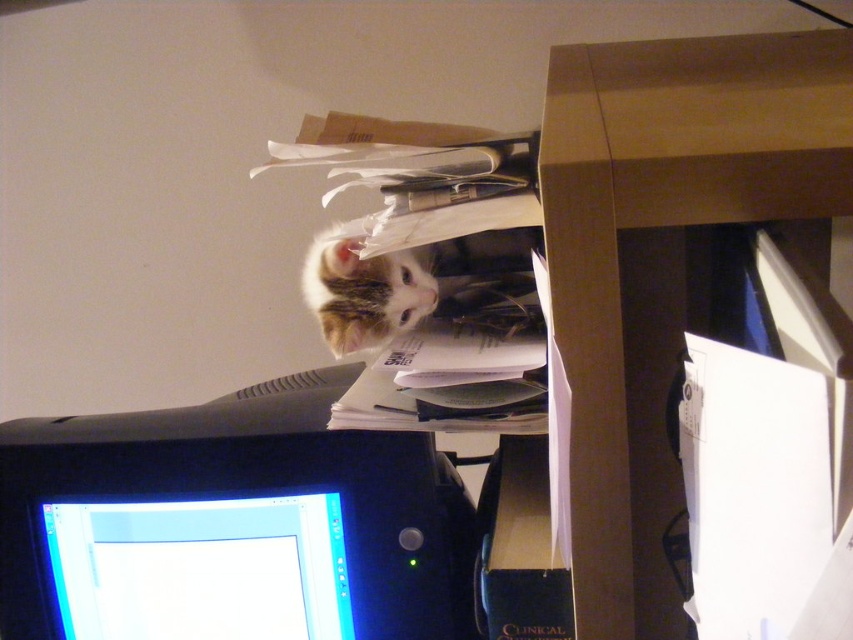
You are a delivery person who needs to place a small package on the desk without disturbing the cat. The package is 10 centimeters wide. The desk has limited space. Considering the black plastic monitor at lower left, can you fit the package on the desk near the monitor?

The black plastic monitor at lower left is 64.68 centimeters away from the camera. Since the package is only 10 centimeters wide, there should be enough space on the desk near the monitor to place it without disturbing the cat.

You are trying to locate the striped fur cat at upper center on a cluttered desk. From the perspective of the cat, which direction would the black plastic monitor at lower left be located?

The black plastic monitor at lower left is to the left of the striped fur cat at upper center, so from the cat perspective, the monitor is on its left side.

You are organizing your workspace and need to know which object takes up more space. Which is bigger between the brown wood computer desk at center and the black plastic monitor at lower left?

The brown wood computer desk at center is larger in size than the black plastic monitor at lower left, so the desk takes up more space.